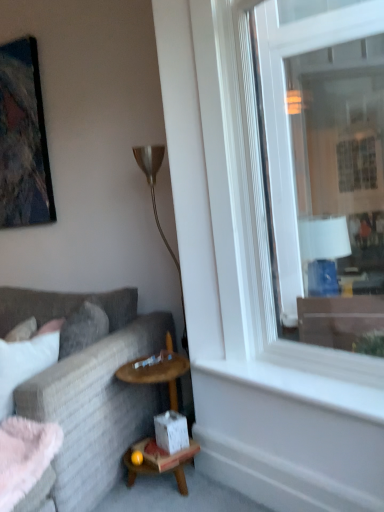
Question: From their relative heights in the image, would you say textured gray couch at left is taller or shorter than matte black picture frame at upper left?

Choices:
 (A) tall
 (B) short

Answer: (B)

Question: Considering their positions, is textured gray couch at left located in front of or behind matte black picture frame at upper left?

Choices:
 (A) behind
 (B) front

Answer: (B)

Question: Which is farther from the clear glass window at right?

Choices:
 (A) matte black picture frame at upper left
 (B) metallic gold floor lamp at center
 (C) textured gray couch at left
 (D) white smooth window sill at lower right

Answer: (C)

Question: Which object is positioned closest to the matte black picture frame at upper left?

Choices:
 (A) clear glass window at right
 (B) metallic gold floor lamp at center
 (C) textured gray couch at left
 (D) white smooth window sill at lower right

Answer: (B)